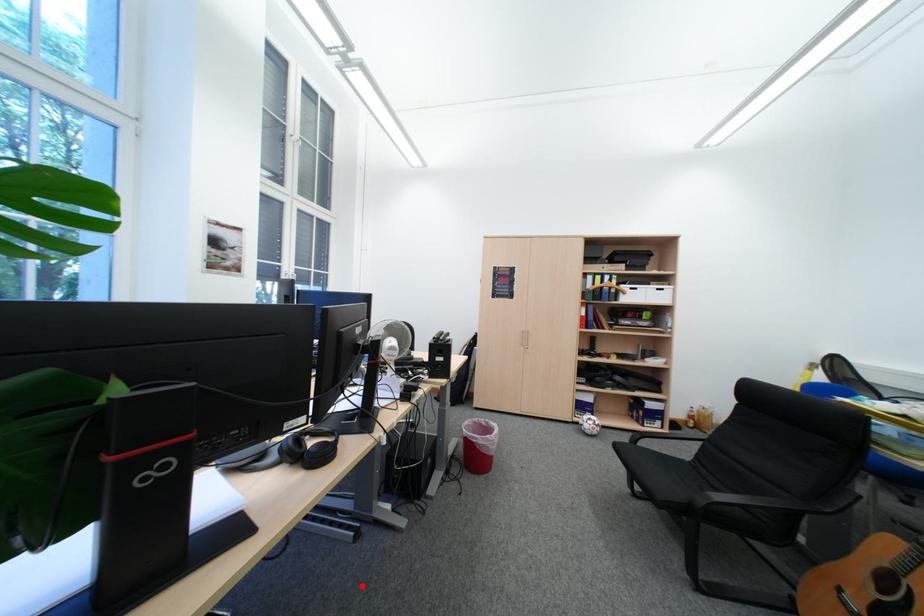
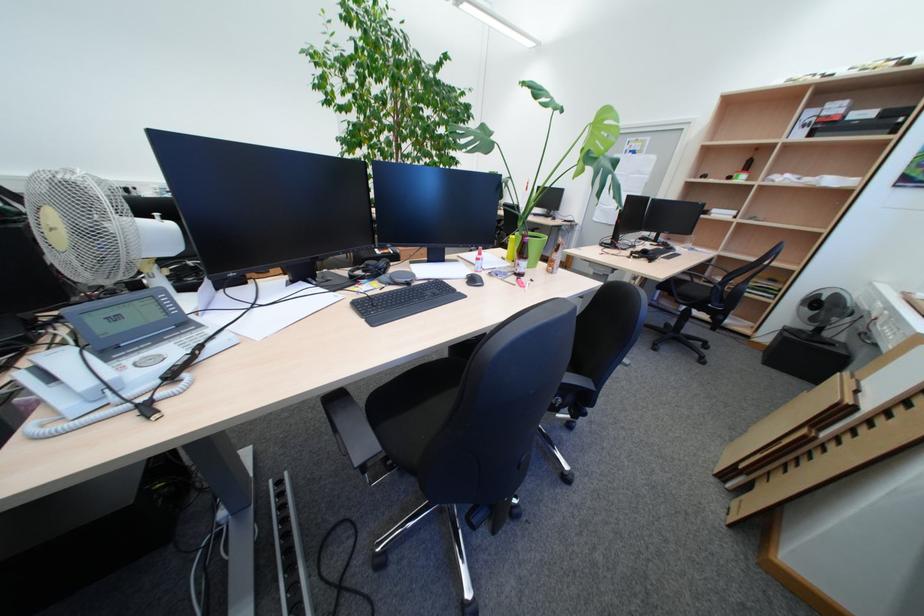
In the second image, find the point that corresponds to the highlighted location in the first image.

(338, 439)